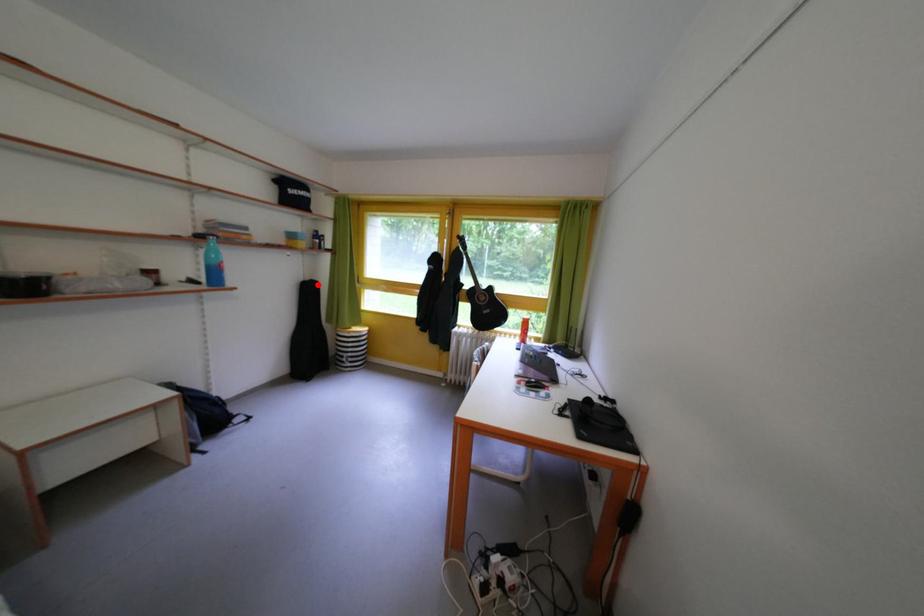
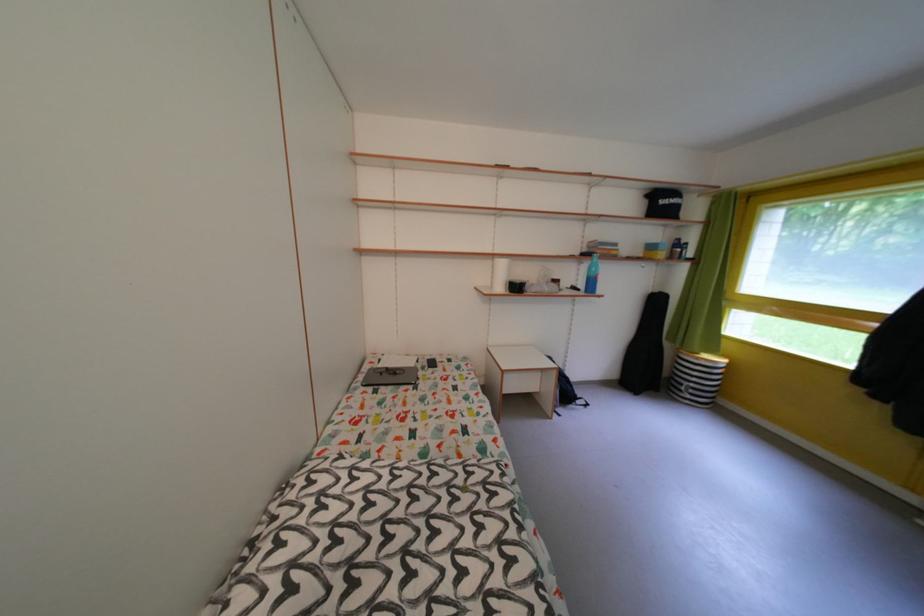
In the second image, find the point that corresponds to the highlighted location in the first image.

(665, 296)